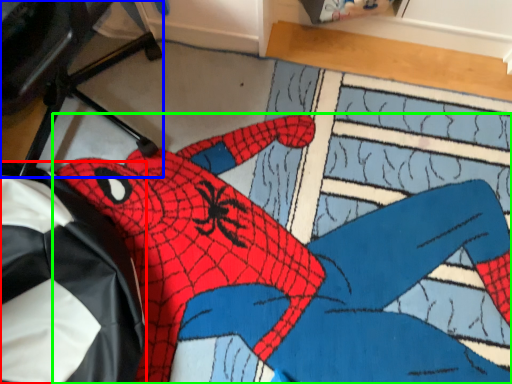
Question: Which object is the farthest from bean bag chair (highlighted by a red box)? Choose among these: computer chair (highlighted by a blue box) or person (highlighted by a green box).

Choices:
 (A) computer chair
 (B) person

Answer: (A)